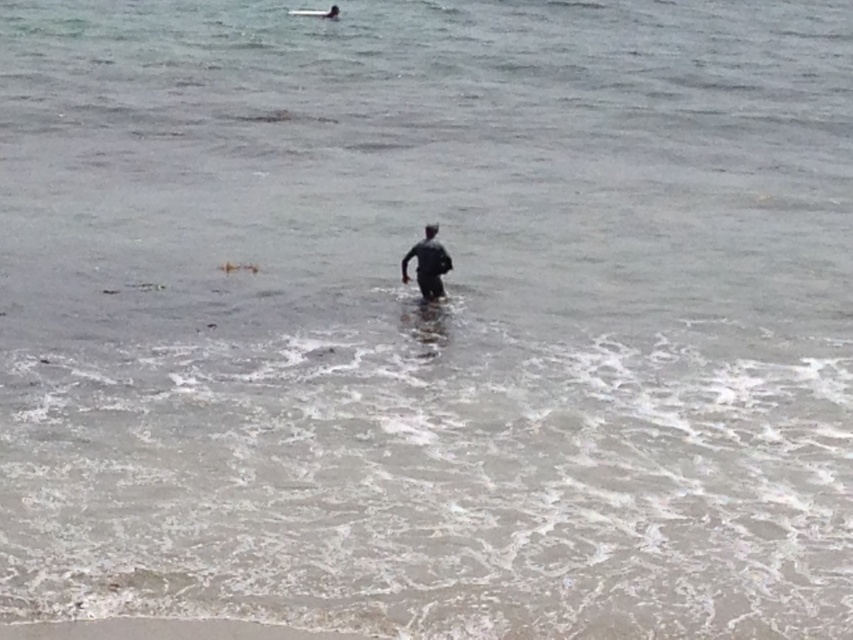
Can you confirm if dark gray wetsuit at center is bigger than white foam surfboard at center?

Incorrect, dark gray wetsuit at center is not larger than white foam surfboard at center.

Between point (402, 275) and point (325, 16), which one is positioned behind?

The point (325, 16) is more distant.

The image size is (853, 640). What do you see at coordinates (427, 262) in the screenshot? I see `dark gray wetsuit at center` at bounding box center [427, 262].

Where is `dark gray wetsuit at center`? dark gray wetsuit at center is located at coordinates (427, 262).

Which is below, smooth sand at lower center or white foam surfboard at center?

smooth sand at lower center

This screenshot has height=640, width=853. I want to click on smooth sand at lower center, so click(163, 628).

Looking at this image, can you confirm if smooth sand at lower center is positioned to the left of dark gray wetsuit at center?

Yes, smooth sand at lower center is to the left of dark gray wetsuit at center.

Is smooth sand at lower center smaller than dark gray wetsuit at center?

Yes.

Is point (111, 637) positioned before point (427, 244)?

Yes.

You are a GUI agent. You are given a task and a screenshot of the screen. Output one action in this format:
    pyautogui.click(x=<x>, y=<y>)
    Task: Click on the smooth sand at lower center
    
    Given the screenshot: What is the action you would take?
    pyautogui.click(x=163, y=628)